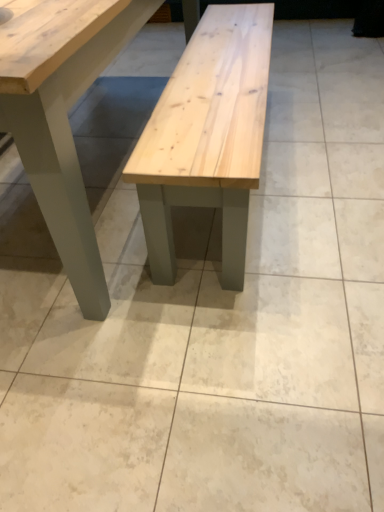
This screenshot has height=512, width=384. Identify the location of vacant region under natural wood table at center (from a real-world perspective). (105, 144).